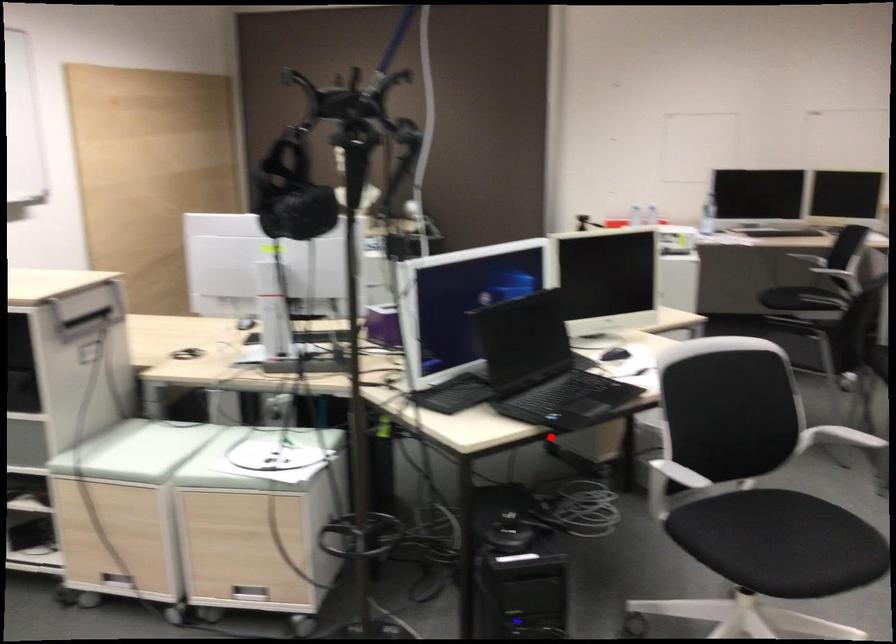
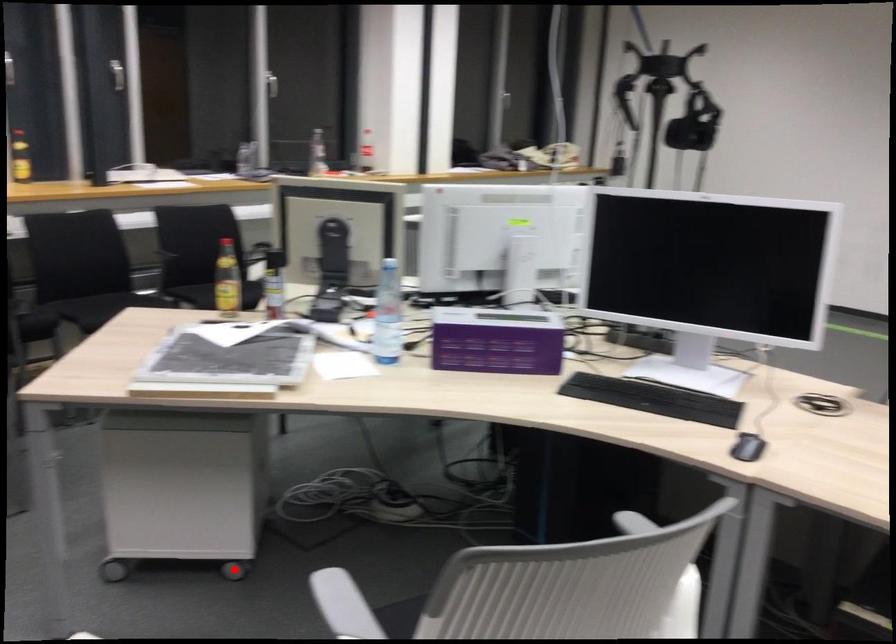
I am providing you with two images of the same scene from different viewpoints. A red point is marked on the first image and another point is marked on the second image. Are the points marked in image1 and image2 representing the same 3D position?

Yes